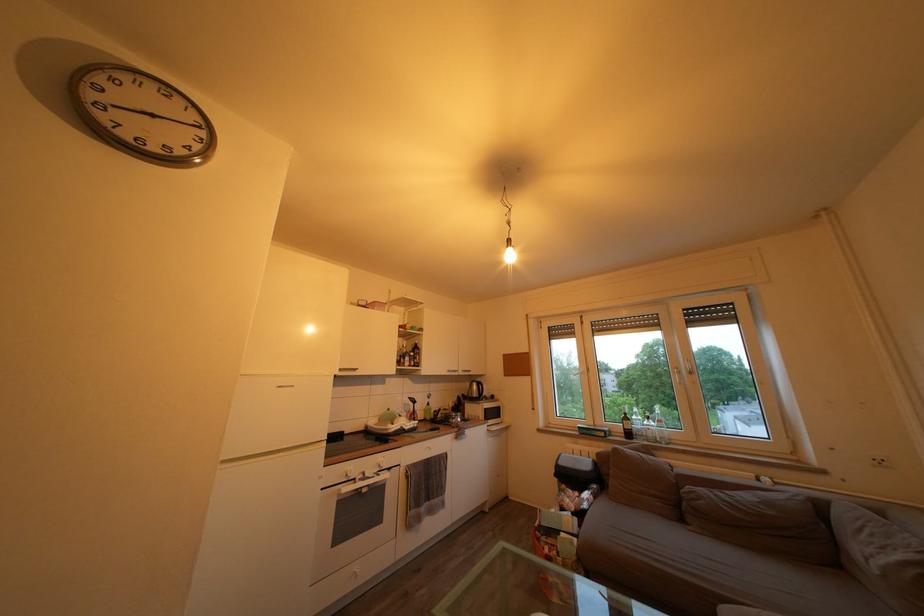
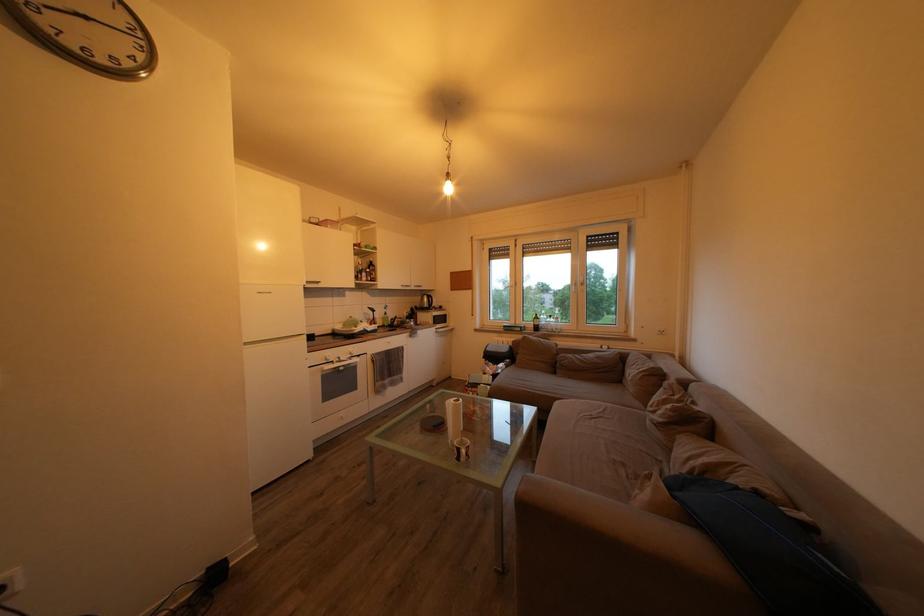
The point at (421, 408) is marked in the first image. Where is the corresponding point in the second image?

(381, 317)